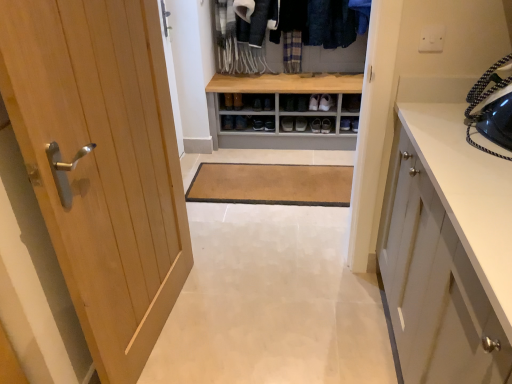
Question: Should I look upward or downward to see white plastic electric outlet at upper center?

Choices:
 (A) down
 (B) up

Answer: (B)

Question: Is matte black shoe at center, which appears as the 3th footwear when viewed from the right, positioned before brown leather shoe at center, positioned as the first shoe in top-to-bottom order?

Choices:
 (A) yes
 (B) no

Answer: (B)

Question: Does matte black shoe at center, the 1th footwear viewed from the left, lie behind brown leather shoe at center, positioned as the first shoe in top-to-bottom order?

Choices:
 (A) no
 (B) yes

Answer: (B)

Question: Is matte black shoe at center, which appears as the 3th footwear when viewed from the right, located outside brown leather shoe at center, the 1th shoe in the right-to-left sequence?

Choices:
 (A) no
 (B) yes

Answer: (B)

Question: Is matte black shoe at center, which appears as the 3th footwear when viewed from the right, facing away from brown leather shoe at center, positioned as the second shoe in left-to-right order?

Choices:
 (A) no
 (B) yes

Answer: (A)

Question: Considering the relative sizes of matte black shoe at center, the 1th footwear viewed from the left, and brown leather shoe at center, acting as the 2th shoe starting from the bottom, in the image provided, is matte black shoe at center, the 1th footwear viewed from the left, smaller than brown leather shoe at center, acting as the 2th shoe starting from the bottom,?

Choices:
 (A) yes
 (B) no

Answer: (A)

Question: From the image's perspective, is matte black shoe at center, the 1th footwear viewed from the left, beneath brown leather shoe at center, positioned as the second shoe in left-to-right order?

Choices:
 (A) yes
 (B) no

Answer: (A)

Question: Would you say white leather shoe at center, which ranks as the 1th footwear in right-to-left order, contains brown leather shoe at center, positioned as the first shoe in top-to-bottom order?

Choices:
 (A) yes
 (B) no

Answer: (B)

Question: From the image's perspective, is white leather shoe at center, the third footwear from the left, on top of brown leather shoe at center, acting as the 2th shoe starting from the bottom?

Choices:
 (A) no
 (B) yes

Answer: (A)

Question: Is white leather shoe at center, which ranks as the 1th footwear in right-to-left order, to the right of brown leather shoe at center, the 1th shoe in the right-to-left sequence, from the viewer's perspective?

Choices:
 (A) yes
 (B) no

Answer: (A)

Question: Does white leather shoe at center, the third footwear from the left, have a larger size compared to brown leather shoe at center, the 1th shoe in the right-to-left sequence?

Choices:
 (A) no
 (B) yes

Answer: (B)

Question: Does white leather shoe at center, the third footwear from the left, have a greater width compared to brown leather shoe at center, acting as the 2th shoe starting from the bottom?

Choices:
 (A) no
 (B) yes

Answer: (B)

Question: Can you confirm if white leather shoe at center, which ranks as the 1th footwear in right-to-left order, is positioned to the left of brown leather shoe at center, acting as the 2th shoe starting from the bottom?

Choices:
 (A) yes
 (B) no

Answer: (B)

Question: Does dark blue woolen sweater at upper center have a lesser height compared to light wood door at left?

Choices:
 (A) no
 (B) yes

Answer: (B)